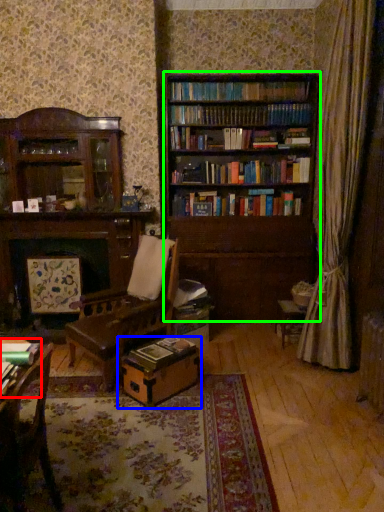
Question: Which object is the closest to the book (highlighted by a red box)? Choose among these: cardboard box (highlighted by a blue box) or bookcase (highlighted by a green box).

Choices:
 (A) cardboard box
 (B) bookcase

Answer: (A)